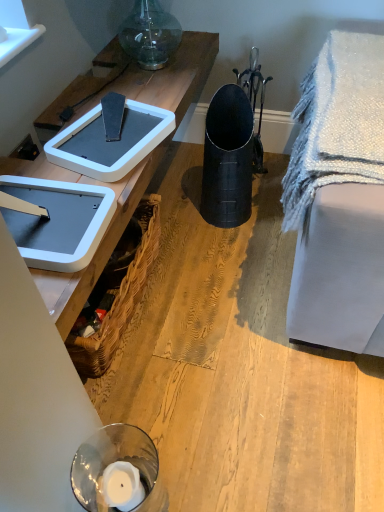
Question: Does woven brown picnic basket at lower left have a greater height compared to white plastic weight scale at upper left, positioned as the first weight scale in front-to-back order?

Choices:
 (A) yes
 (B) no

Answer: (A)

Question: Is white plastic weight scale at upper left, the 2th weight scale viewed from the back, a part of woven brown picnic basket at lower left?

Choices:
 (A) no
 (B) yes

Answer: (A)

Question: From a real-world perspective, is woven brown picnic basket at lower left on white plastic weight scale at upper left, positioned as the first weight scale in front-to-back order?

Choices:
 (A) yes
 (B) no

Answer: (B)

Question: Is woven brown picnic basket at lower left outside of white plastic weight scale at upper left, positioned as the first weight scale in front-to-back order?

Choices:
 (A) yes
 (B) no

Answer: (A)

Question: From a real-world perspective, is woven brown picnic basket at lower left physically below white plastic weight scale at upper left, positioned as the first weight scale in front-to-back order?

Choices:
 (A) yes
 (B) no

Answer: (A)

Question: Considering the relative positions of woven brown picnic basket at lower left and white plastic weight scale at upper left, the 2th weight scale viewed from the back, in the image provided, is woven brown picnic basket at lower left to the left of white plastic weight scale at upper left, the 2th weight scale viewed from the back, from the viewer's perspective?

Choices:
 (A) no
 (B) yes

Answer: (A)

Question: Is white plastic weight scale at upper left, the 2th weight scale viewed from the back, a part of matte black trash can at center?

Choices:
 (A) yes
 (B) no

Answer: (B)

Question: Is there a large distance between matte black trash can at center and white plastic weight scale at upper left, positioned as the first weight scale in front-to-back order?

Choices:
 (A) yes
 (B) no

Answer: (B)

Question: From the image's perspective, is matte black trash can at center located beneath white plastic weight scale at upper left, positioned as the first weight scale in front-to-back order?

Choices:
 (A) no
 (B) yes

Answer: (B)

Question: Is white plastic weight scale at upper left, positioned as the first weight scale in front-to-back order, at the back of matte black trash can at center?

Choices:
 (A) yes
 (B) no

Answer: (B)

Question: Does matte black trash can at center have a lesser width compared to white plastic weight scale at upper left, positioned as the first weight scale in front-to-back order?

Choices:
 (A) yes
 (B) no

Answer: (B)

Question: Is matte black trash can at center further to camera compared to white plastic weight scale at upper left, the 2th weight scale viewed from the back?

Choices:
 (A) yes
 (B) no

Answer: (A)

Question: From the image's perspective, is woven brown picnic basket at lower left on top of white textured blanket at right?

Choices:
 (A) yes
 (B) no

Answer: (B)